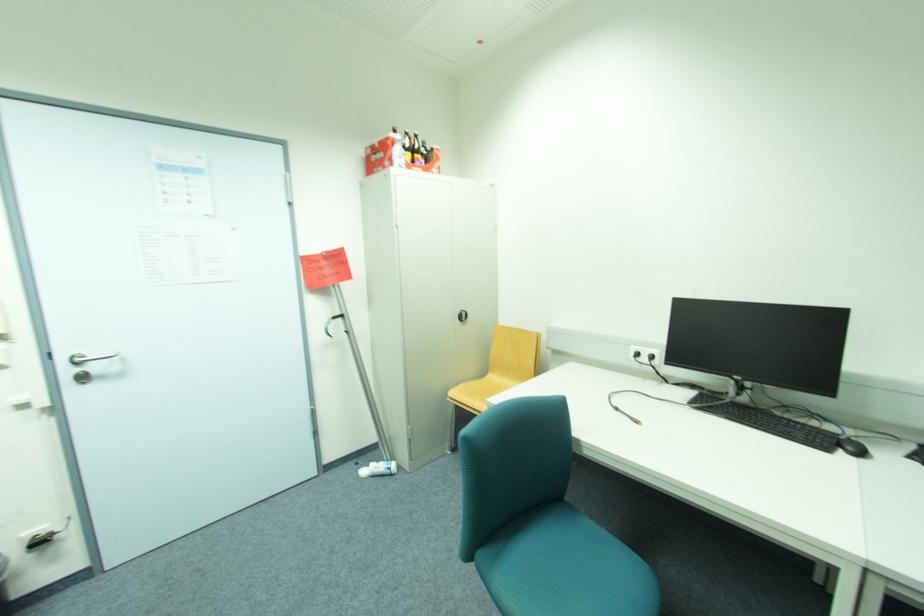
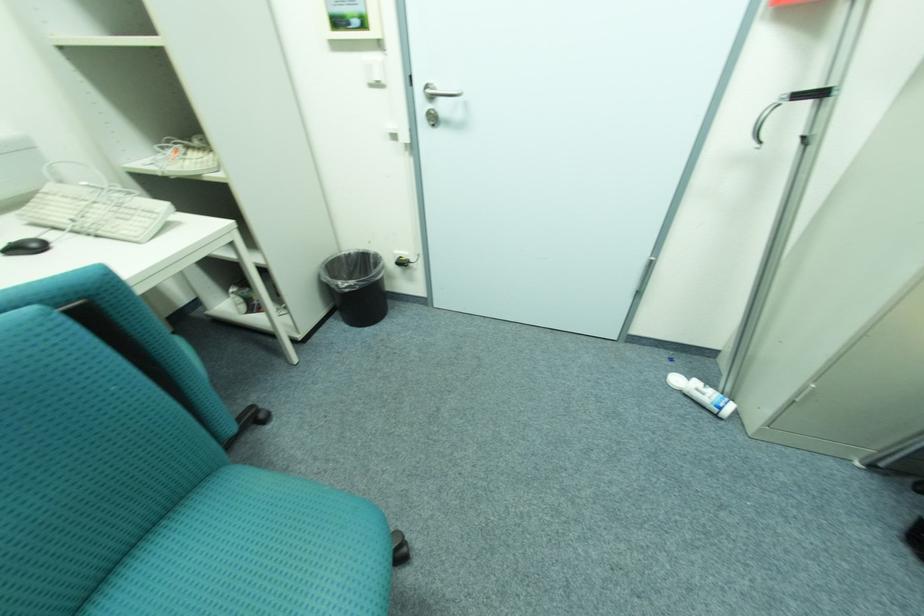
Based on the photo, the first image is from the beginning of the video and the second image is from the end. How did the camera likely rotate when shooting the video?

The camera rotated toward left-down.